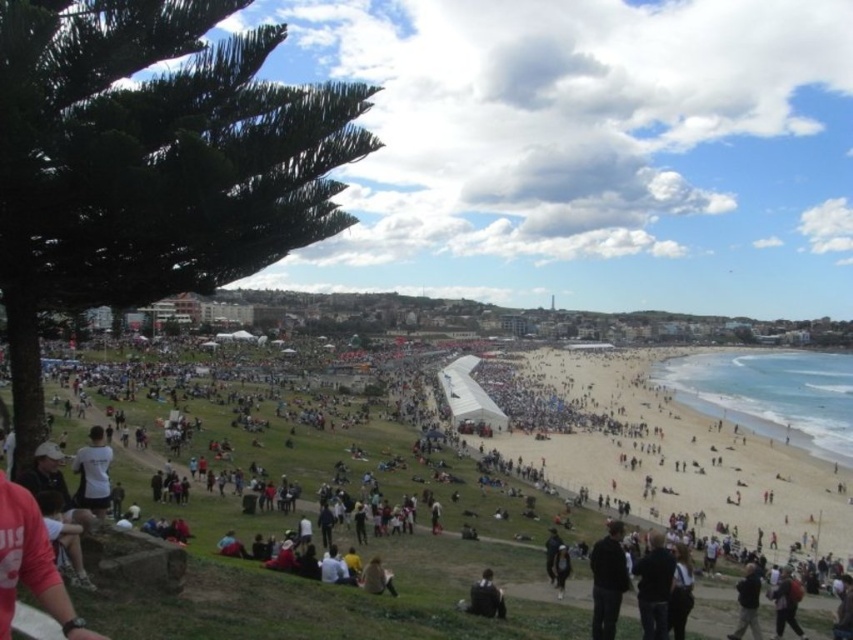
Question: In this image, where is white cotton shirt at lower left located relative to dark brown leather jacket at lower center?

Choices:
 (A) left
 (B) right

Answer: (B)

Question: Which point is closer to the camera?

Choices:
 (A) dark gray jacket at lower center
 (B) white cotton shirt at lower left

Answer: (B)

Question: Considering the relative positions of white cotton shirt at lower left and dark brown leather jacket at lower center in the image provided, where is white cotton shirt at lower left located with respect to dark brown leather jacket at lower center?

Choices:
 (A) left
 (B) right

Answer: (B)

Question: Which point appears farthest from the camera in this image?

Choices:
 (A) (503, 605)
 (B) (627, 582)
 (C) (776, 468)

Answer: (C)

Question: Which of the following is the farthest from the observer?

Choices:
 (A) dark brown leather jacket at lower center
 (B) white cotton shirt at lower left
 (C) dark gray jacket at lower center

Answer: (A)

Question: Is dark gray jacket at lower center wider than dark brown leather jacket at lower center?

Choices:
 (A) yes
 (B) no

Answer: (A)